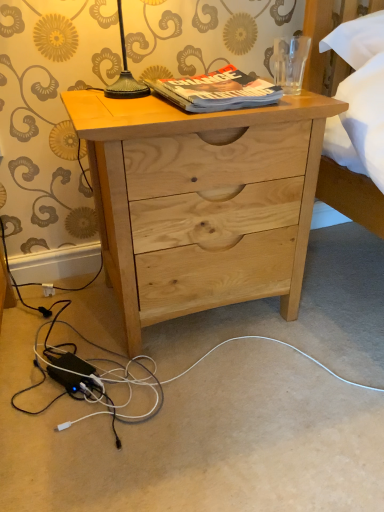
Question: From a real-world perspective, is natural wood nightstand at center above or below hardcover book at upper center?

Choices:
 (A) below
 (B) above

Answer: (A)

Question: Which is correct: natural wood nightstand at center is inside hardcover book at upper center, or outside of it?

Choices:
 (A) inside
 (B) outside

Answer: (B)

Question: Is natural wood nightstand at center bigger or smaller than hardcover book at upper center?

Choices:
 (A) big
 (B) small

Answer: (A)

Question: Looking at their shapes, would you say hardcover book at upper center is wider or thinner than natural wood nightstand at center?

Choices:
 (A) thin
 (B) wide

Answer: (A)

Question: Considering the positions of hardcover book at upper center and natural wood nightstand at center in the image, is hardcover book at upper center bigger or smaller than natural wood nightstand at center?

Choices:
 (A) small
 (B) big

Answer: (A)

Question: From their relative heights in the image, would you say hardcover book at upper center is taller or shorter than natural wood nightstand at center?

Choices:
 (A) tall
 (B) short

Answer: (B)

Question: From a real-world perspective, is hardcover book at upper center above or below natural wood nightstand at center?

Choices:
 (A) above
 (B) below

Answer: (A)